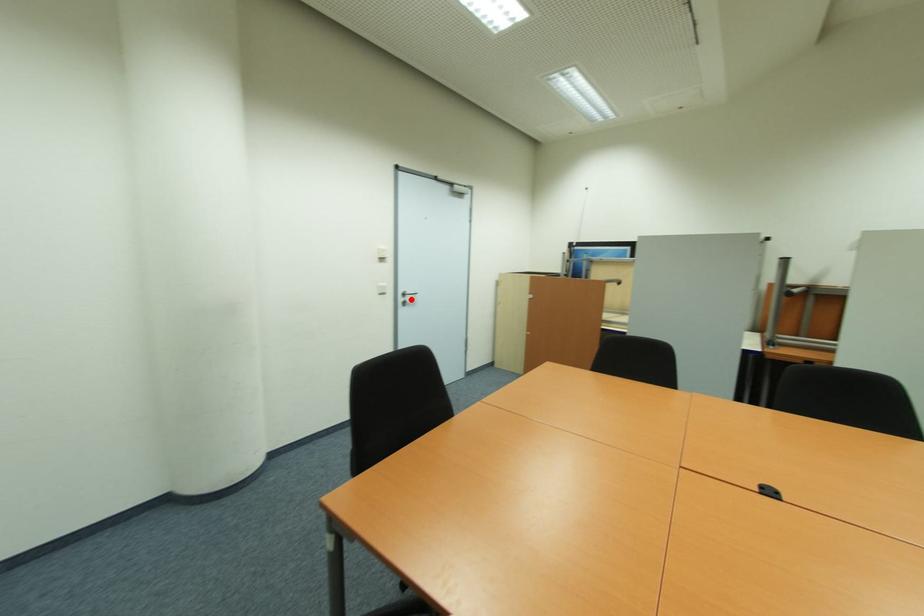
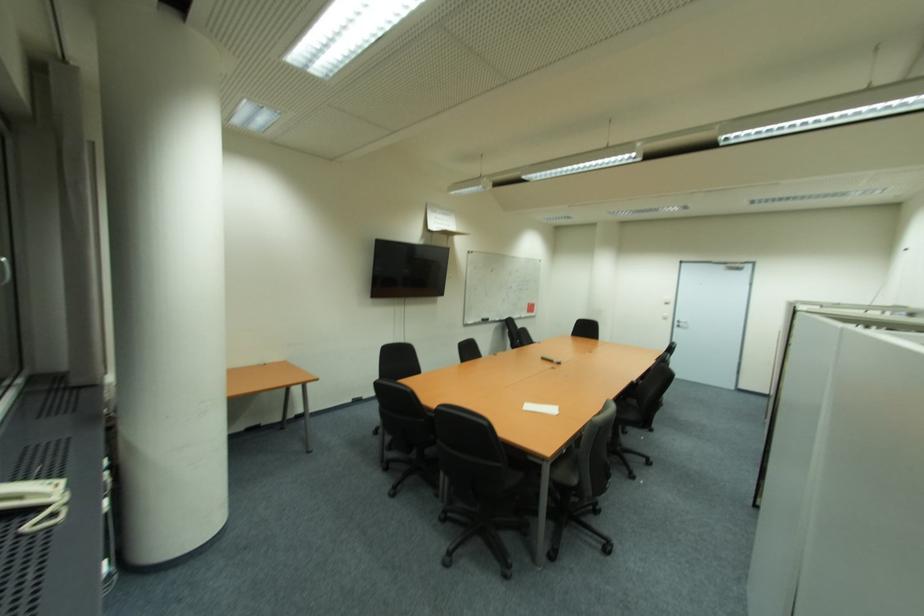
The point at the highlighted location is marked in the first image. Where is the corresponding point in the second image?

(686, 325)